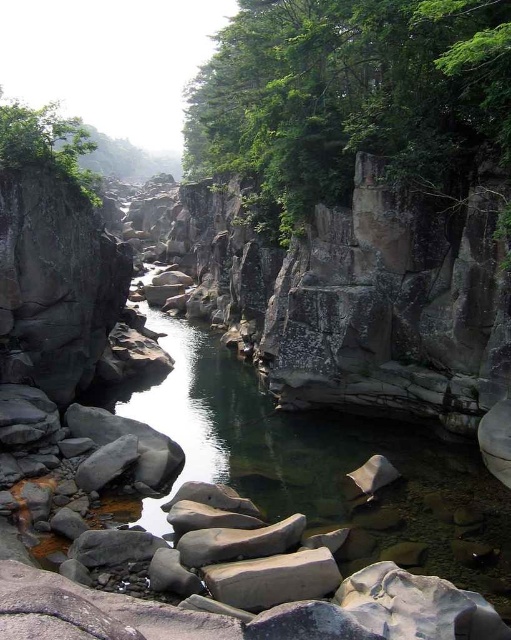
Which of these two, green leafy tree at upper center or green leafy tree at upper left, stands taller?

green leafy tree at upper left

Which is behind, point (269, 157) or point (16, 104)?

Point (16, 104)

The image size is (511, 640). I want to click on green leafy tree at upper center, so click(353, 100).